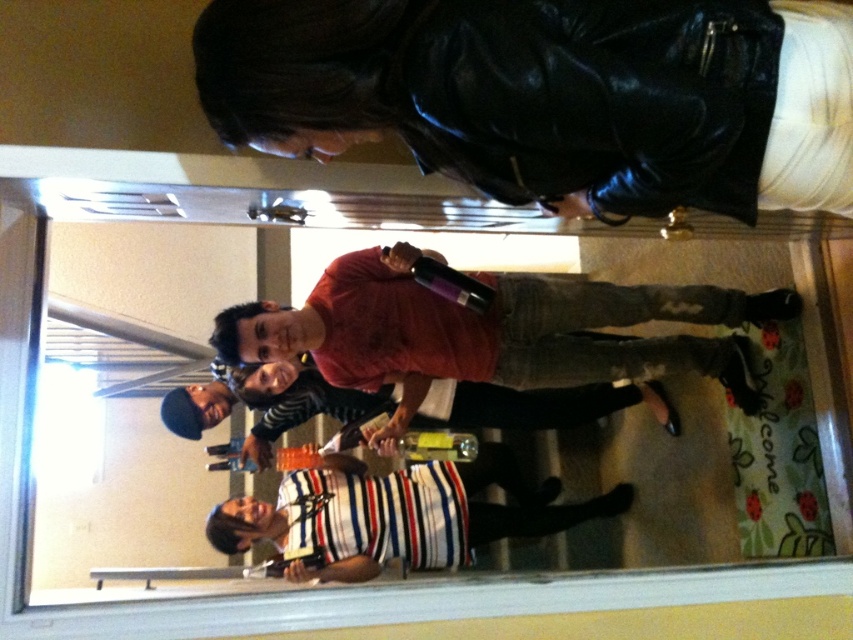
You are a photographer trying to capture a candid shot of the two people in the scene, the black leather jacket at upper center and the striped cotton shirt at center. Since your camera has a limited focus range, you need to know which one is closer to the camera. Can you determine which one is closer based on their sizes in the reflection?

The black leather jacket at upper center is narrower than the striped cotton shirt at center, so the black leather jacket at upper center is closer to the camera because objects closer to the camera appear larger in the reflection, but since it is narrower, it might be farther away. Wait, this is conflicting. Let me think again. If the black leather jacket at upper center has a smaller width than the striped cotton shirt at center, that suggests it is farther away because objects farther away appear smaller

You are standing in the room and see the point at coordinates (552, 96). What object is located at that point?

The point at coordinates (552, 96) corresponds to the black leather jacket at upper center.